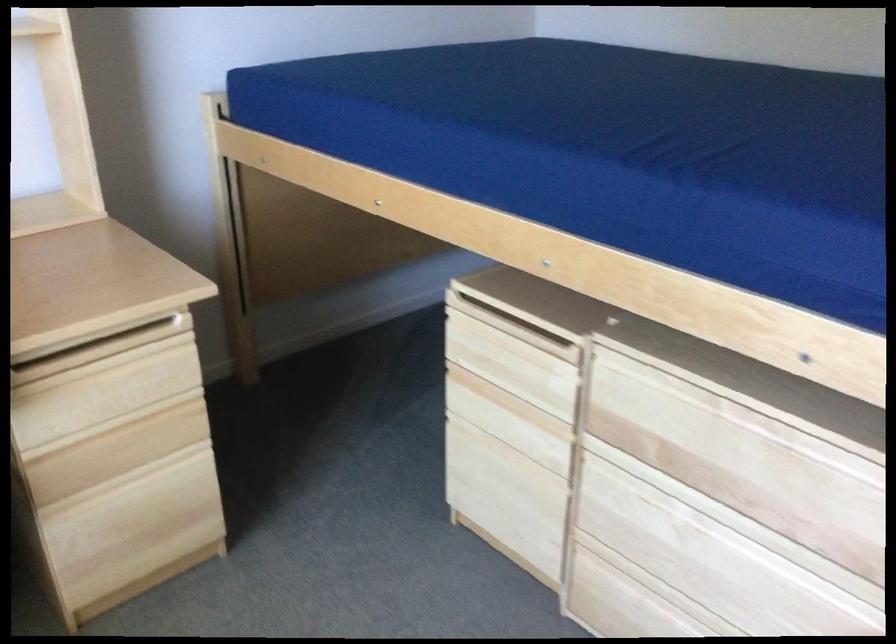
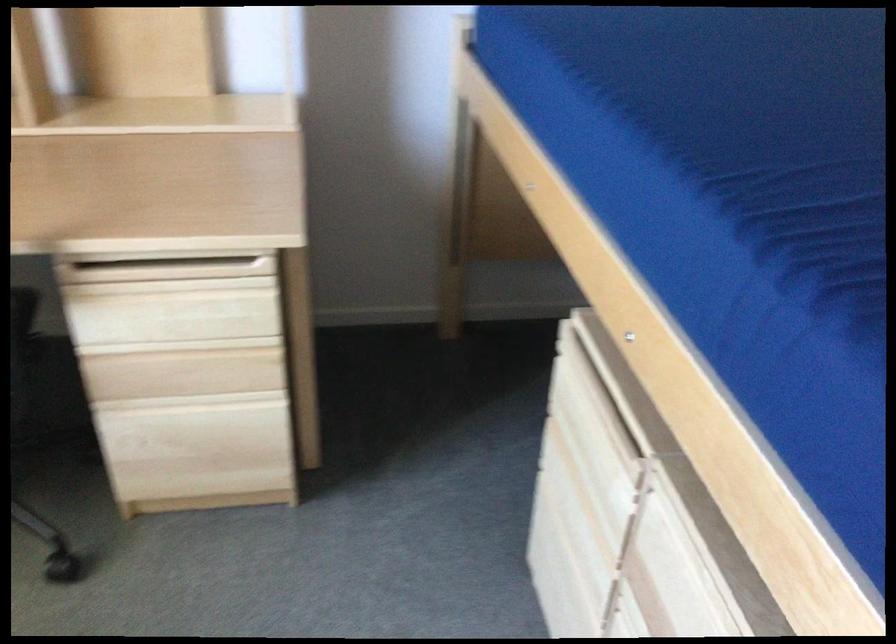
Where in the second image is the point corresponding to point 145,534 from the first image?

(202, 460)